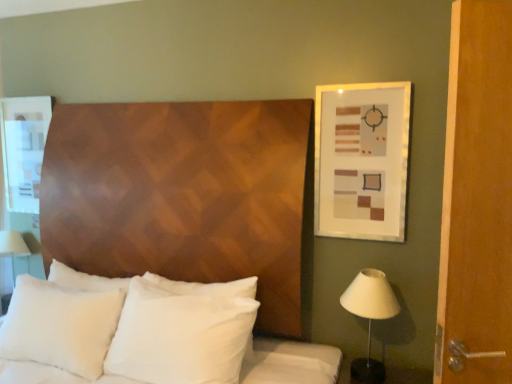
Question: Can you confirm if matte white picture frame at upper right is shorter than white fabric table lamp at left?

Choices:
 (A) yes
 (B) no

Answer: (B)

Question: Does matte white picture frame at upper right have a smaller size compared to white fabric table lamp at left?

Choices:
 (A) yes
 (B) no

Answer: (A)

Question: Is matte white picture frame at upper right at the left side of white fabric table lamp at left?

Choices:
 (A) yes
 (B) no

Answer: (B)

Question: Is the position of matte white picture frame at upper right more distant than that of white fabric table lamp at left?

Choices:
 (A) yes
 (B) no

Answer: (B)

Question: Is white fabric table lamp at left located within matte white picture frame at upper right?

Choices:
 (A) yes
 (B) no

Answer: (B)

Question: Is white soft pillow at center, which is the 2th pillow from right to left, wider or thinner than white soft pillow at center, acting as the 2th pillow starting from the left?

Choices:
 (A) wide
 (B) thin

Answer: (A)

Question: In the image, is white soft pillow at center, acting as the 1th pillow starting from the left, positioned in front of or behind white soft pillow at center, the first pillow viewed from the right?

Choices:
 (A) front
 (B) behind

Answer: (A)

Question: From their relative heights in the image, would you say white soft pillow at center, acting as the 1th pillow starting from the left, is taller or shorter than white soft pillow at center, acting as the 2th pillow starting from the left?

Choices:
 (A) short
 (B) tall

Answer: (B)

Question: From a real-world perspective, is white soft pillow at center, acting as the 1th pillow starting from the left, above or below white soft pillow at center, acting as the 2th pillow starting from the left?

Choices:
 (A) above
 (B) below

Answer: (B)

Question: From a real-world perspective, relative to matte white picture frame at upper right, is white fabric table lamp at left vertically above or below?

Choices:
 (A) below
 (B) above

Answer: (A)

Question: Choose the correct answer: Is white fabric table lamp at left inside matte white picture frame at upper right or outside it?

Choices:
 (A) outside
 (B) inside

Answer: (A)

Question: Considering the positions of white fabric table lamp at left and matte white picture frame at upper right in the image, is white fabric table lamp at left wider or thinner than matte white picture frame at upper right?

Choices:
 (A) thin
 (B) wide

Answer: (B)

Question: Does point (10, 236) appear closer or farther from the camera than point (352, 233)?

Choices:
 (A) farther
 (B) closer

Answer: (A)

Question: From the image's perspective, is white fabric table lamp at left above or below white soft pillows at center?

Choices:
 (A) above
 (B) below

Answer: (A)

Question: In terms of size, does white fabric table lamp at left appear bigger or smaller than white soft pillows at center?

Choices:
 (A) big
 (B) small

Answer: (B)